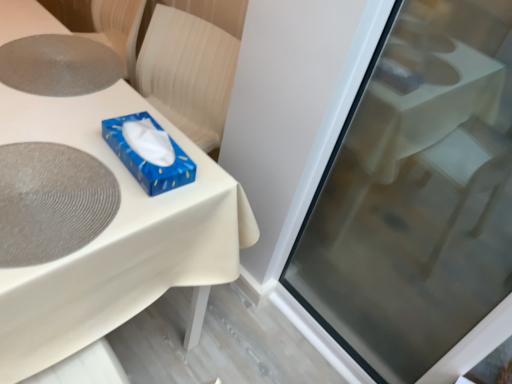
Where is `vacant space situated on the left part of blue glossy tissue box at upper center`? This screenshot has width=512, height=384. vacant space situated on the left part of blue glossy tissue box at upper center is located at coordinates (75, 118).